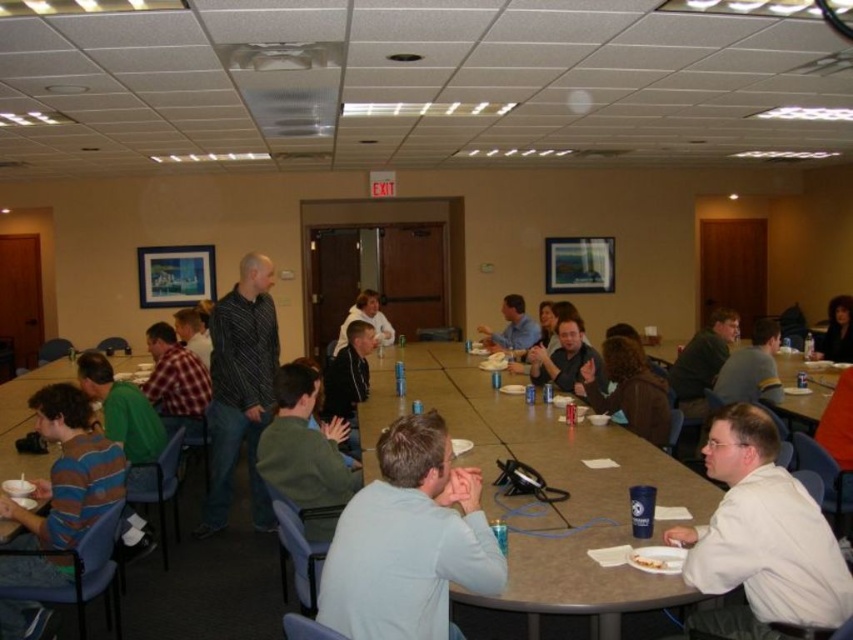
You are a person who is 1.6 meters tall and standing at the center of the room. You want to reach the exit door marked on the wall. There is a green matte jacket at center and a dark brown hair at center in your way. Can you walk straight towards the exit without stepping over or around these objects?

The green matte jacket at center is 1.78 meters away from dark brown hair at center. Since you are 1.6 meters tall, your height is less than the distance between the two objects. Therefore, you can walk straight towards the exit without needing to step over or around the green matte jacket at center and dark brown hair at center.

Looking at this image, you are standing at the entrance of the room and want to locate the person wearing the light blue fabric shirt at center. Based on the coordinates provided, in which direction should you look relative to your position?

The light blue fabric shirt at center is located at coordinates point (408, 540). Since you are at the entrance, you should look towards the center of the room to find the person wearing the light blue fabric shirt at center.

You are a person who needs to sit down quickly. You see the green matte jacket at center and the dark brown hair at center. Which object takes up more space and would be easier to move out of the way?

The dark brown hair at center takes up more space than the green matte jacket at center, so it would be easier to move out of the way.